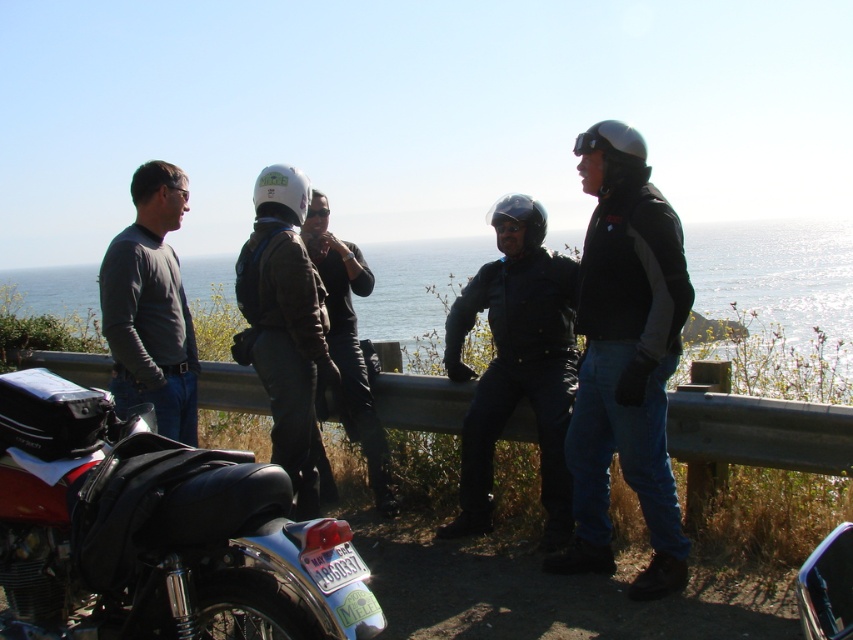
You are a photographer positioned at the center of the scene. You want to take a photo that includes both the shiny chrome motorcycle at lower left and the black matte jacket at center. Which object should you adjust your position towards to ensure both are in frame?

You should adjust your position towards the shiny chrome motorcycle at lower left because it is located to the left of the black matte jacket at center, so moving towards it would help frame both objects in the photo.